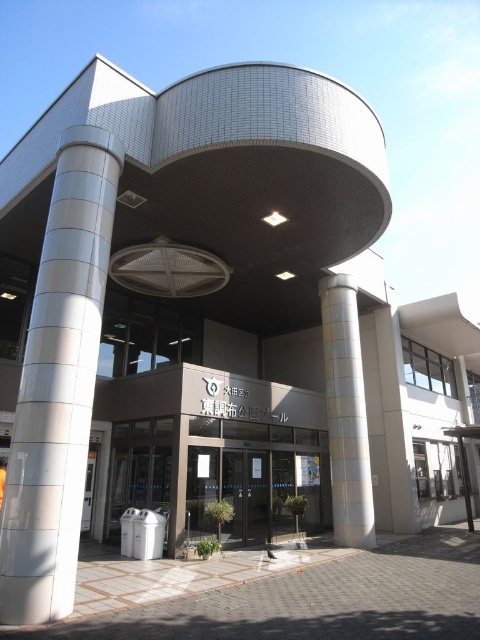
You are standing in front of the modern building and notice two points marked on the facade. The first point is at coordinates point (52, 280) and the second is at point (352, 342). Which of these two points is closer to your current position?

Point (52, 280) is closer to the viewer than point (352, 342).

You are standing in front of the modern building and want to enter through the glass door. To your left, you see the white glossy column at left and the white textured pillar at center. Which object is closer to the entrance?

The white glossy column at left is closer to the entrance because it is positioned on the left side of the white textured pillar at center, which is further away from the entrance.

You are standing 5 meters away from the entrance of the modern building. A maintenance worker needs to reach a specific point marked at coordinates point (x=51, y=372) for repairs. Can they safely reach this point without needing specialized equipment?

The point (x=51, y=372) is 6.61 meters away from the viewer. Since the maintenance worker is standing 5 meters away from the entrance, they would need to move closer to reach the point, but the distance difference is only 1.61 meters. They can likely reach it without specialized equipment unless there are obstacles not mentioned.